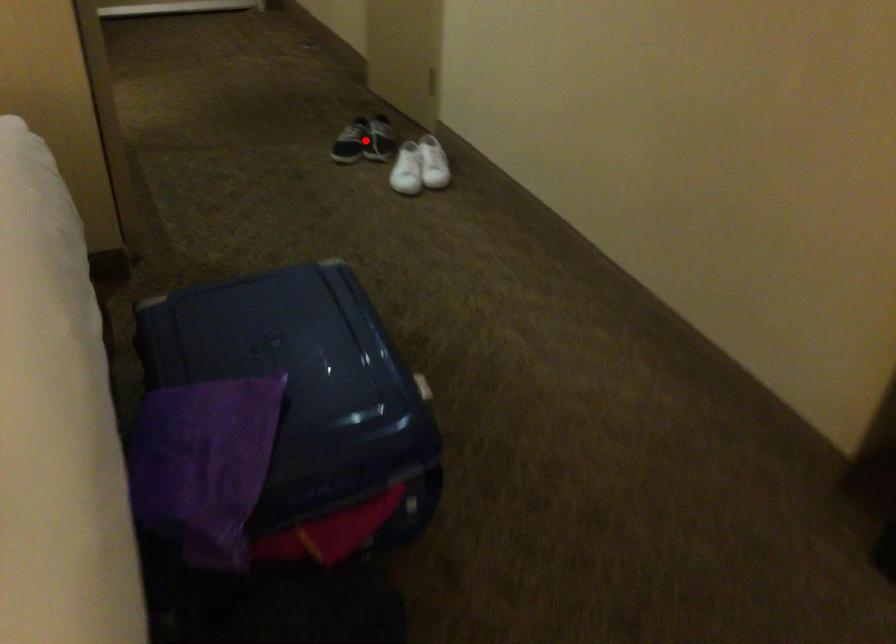
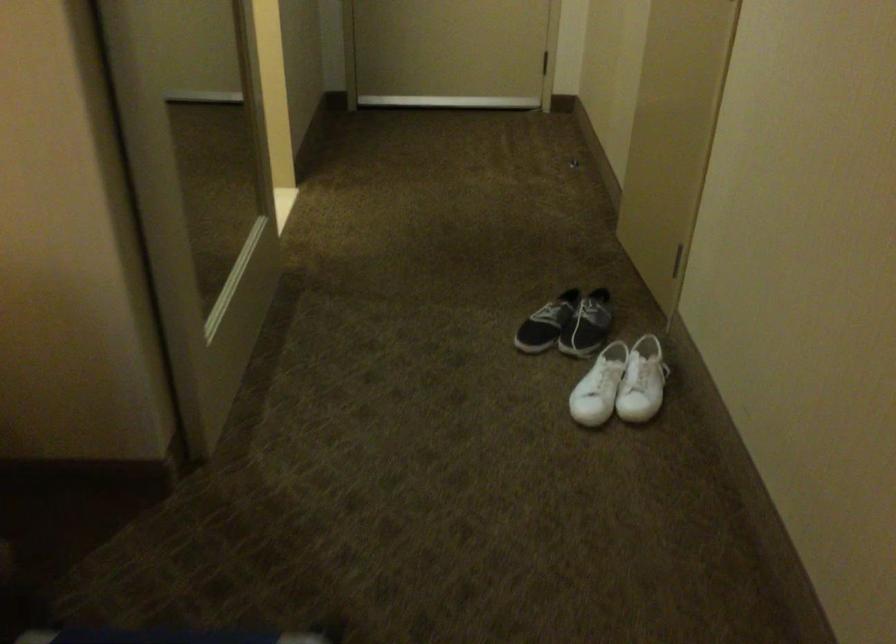
The point at the highlighted location is marked in the first image. Where is the corresponding point in the second image?

(567, 324)